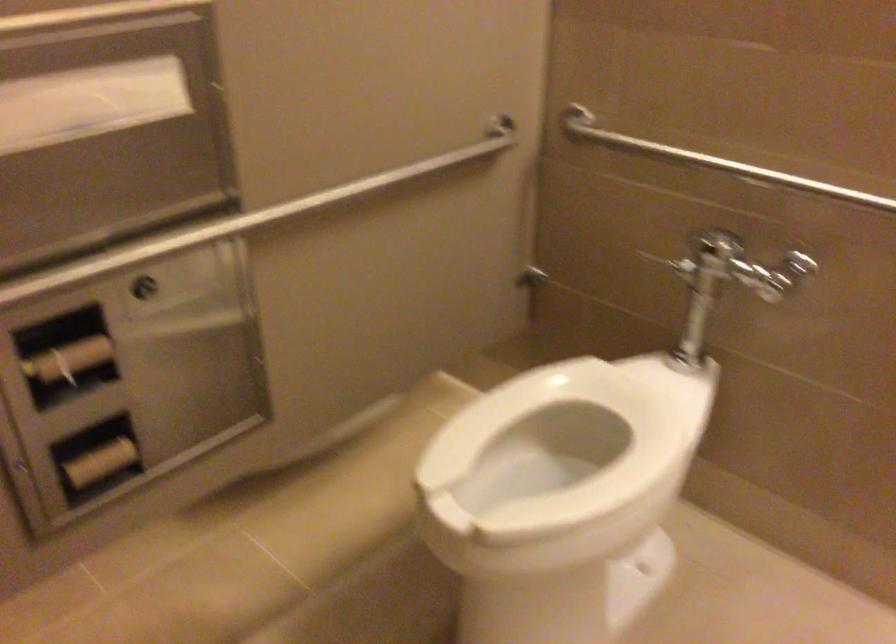
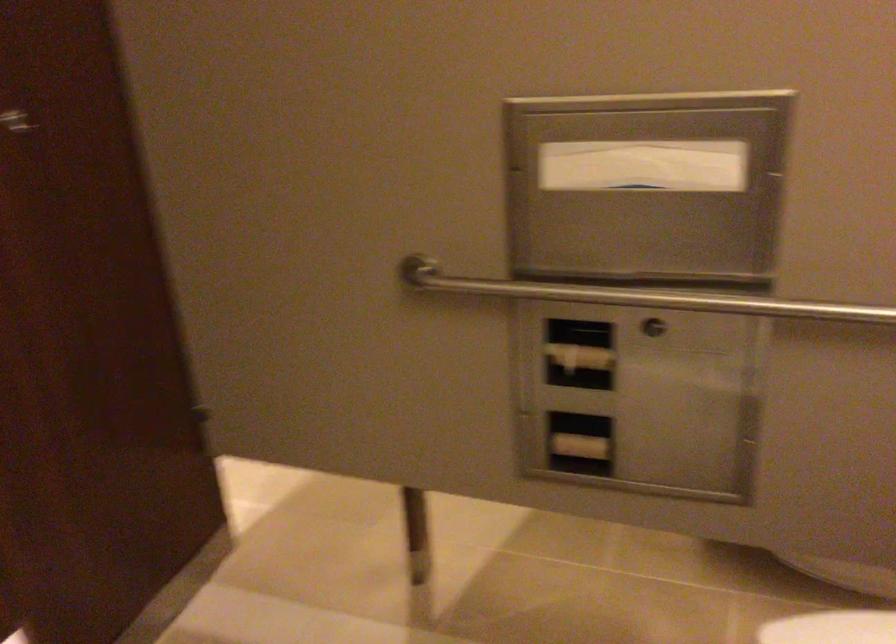
Find the pixel in the second image that matches pixel 88 100 in the first image.

(643, 166)